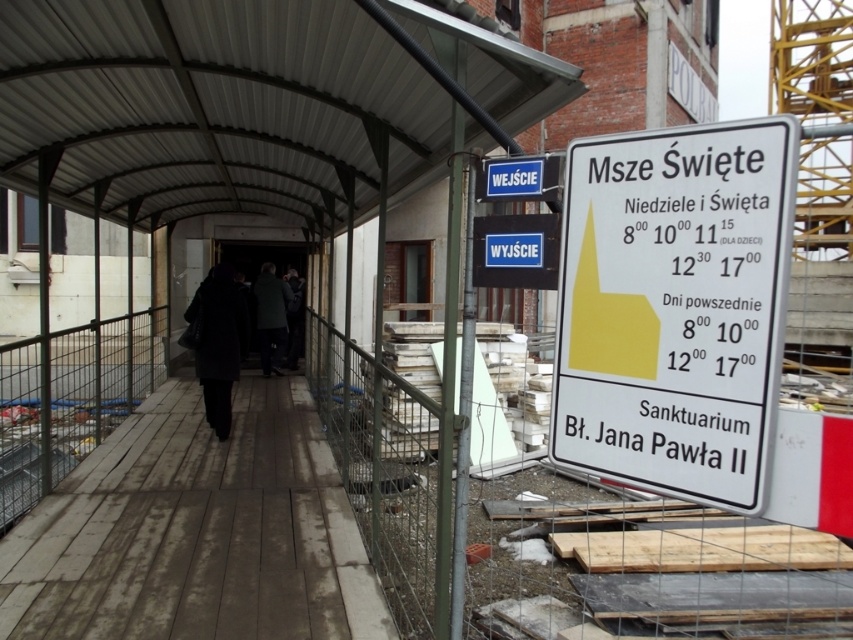
Consider the image. Between wooden planks at center and dark green coat at center, which one is positioned higher?

Positioned higher is dark green coat at center.

Find the location of a particular element. The height and width of the screenshot is (640, 853). wooden planks at center is located at coordinates [196, 531].

The height and width of the screenshot is (640, 853). I want to click on wooden planks at center, so click(x=196, y=531).

This screenshot has height=640, width=853. I want to click on wooden planks at center, so click(196, 531).

Who is positioned more to the left, wooden planks at center or black wool coat at center?

black wool coat at center is more to the left.

Is point (166, 513) farther from viewer compared to point (202, 368)?

No, (166, 513) is closer to viewer.

At what (x,y) coordinates should I click in order to perform the action: click on wooden planks at center. Please return your answer as a coordinate pair (x, y). The width and height of the screenshot is (853, 640). Looking at the image, I should click on (196, 531).

Who is more forward, (726, 474) or (296, 552)?

Point (726, 474) is in front.

Image resolution: width=853 pixels, height=640 pixels. In order to click on white plastic sign at right in this screenshot , I will do `click(675, 307)`.

What are the coordinates of `white plastic sign at right` in the screenshot? It's located at (675, 307).